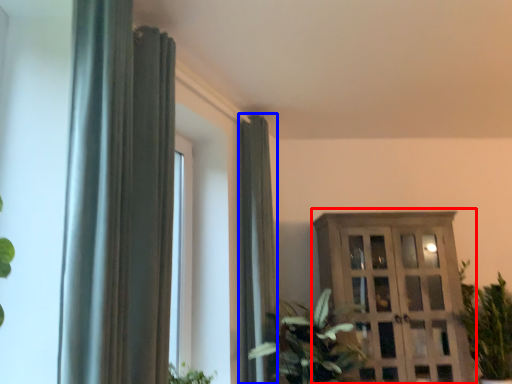
Question: Which of the following is the closest to the observer, dresser (highlighted by a red box) or curtain (highlighted by a blue box)?

Choices:
 (A) dresser
 (B) curtain

Answer: (B)